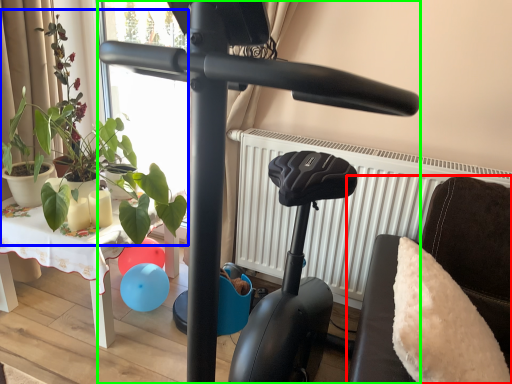
Question: Estimate the real-world distances between objects in this image. Which object is closer to furniture (highlighted by a red box), plant (highlighted by a blue box) or stationary bicycle (highlighted by a green box)?

Choices:
 (A) plant
 (B) stationary bicycle

Answer: (B)